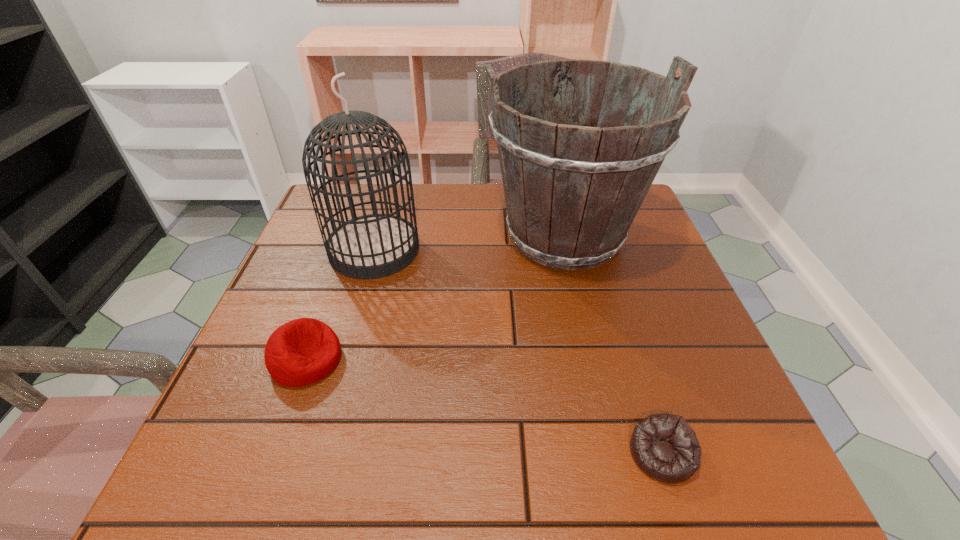
Find the location of `vacant region at the far edge`. vacant region at the far edge is located at coordinates (472, 188).

Identify the location of vacant space at the near edge. (559, 446).

I want to click on free space at the left edge, so click(x=347, y=288).

Find the location of a particular element. Image resolution: width=960 pixels, height=540 pixels. vacant area at the right edge is located at coordinates (624, 293).

Find the location of a particular element. vacant space that is in between the shorter beanbag and the bucket is located at coordinates (613, 344).

Find the location of a particular element. empty location between the left beanbag and the bucket is located at coordinates coord(436,297).

Find the location of `free space between the second shortest object and the shorter beanbag`. free space between the second shortest object and the shorter beanbag is located at coordinates (484, 406).

Where is `vacant region between the bucket and the left beanbag`? The width and height of the screenshot is (960, 540). vacant region between the bucket and the left beanbag is located at coordinates (436, 297).

This screenshot has height=540, width=960. What are the coordinates of `free point between the bucket and the nearest object` in the screenshot? It's located at (613, 344).

You are a GUI agent. You are given a task and a screenshot of the screen. Output one action in this format:
    pyautogui.click(x=<x>, y=<y>)
    Task: Click on the free spot between the bucket and the nearer beanbag
    
    Given the screenshot: What is the action you would take?
    pyautogui.click(x=613, y=344)